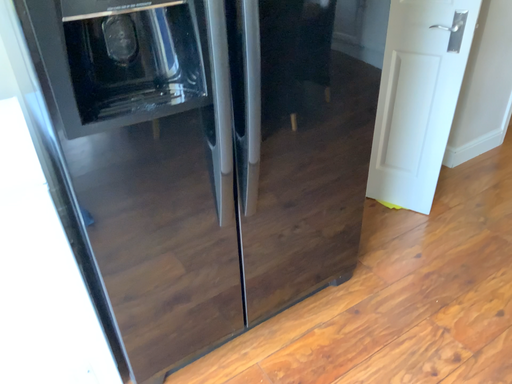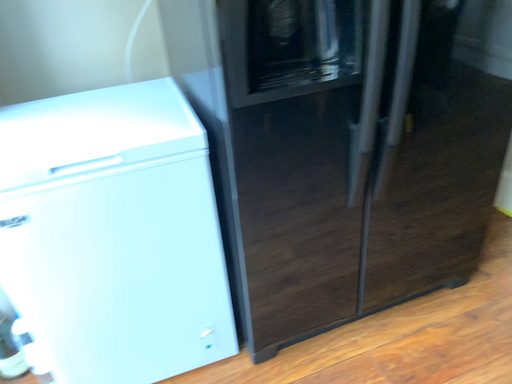
Question: How did the camera likely rotate when shooting the video?

Choices:
 (A) rotated left
 (B) rotated right

Answer: (A)